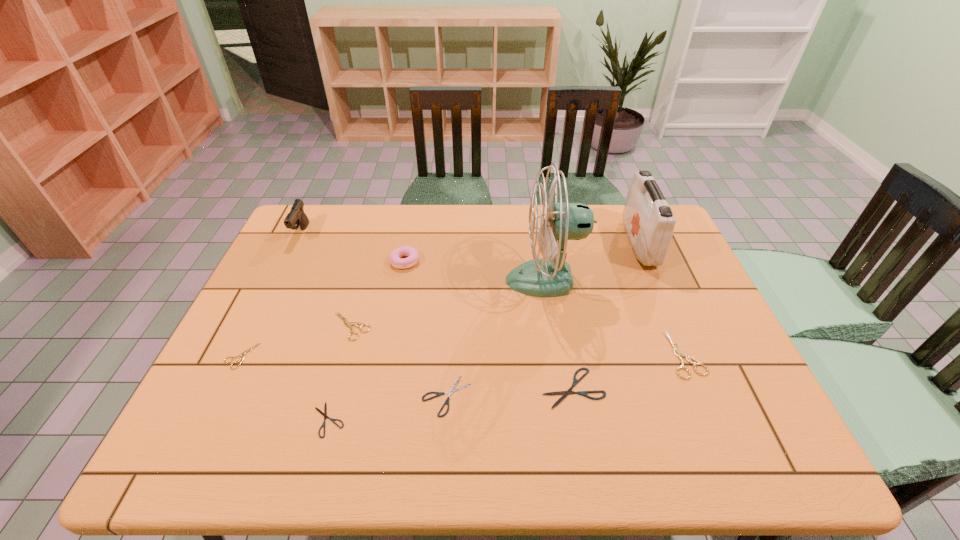
At what (x,y) coordinates should I click in order to perform the action: click on free point that satisfies the following two spatial constraints: 1. on the back side of the shortest shears; 2. on the right side of the fourth shears from left to right. Please return your answer as a coordinate pair (x, y). This screenshot has width=960, height=540. Looking at the image, I should click on (335, 396).

You are a GUI agent. You are given a task and a screenshot of the screen. Output one action in this format:
    pyautogui.click(x=<x>, y=<y>)
    Task: Click on the free space that satisfies the following two spatial constraints: 1. at the barrel of the fifth object from left to right; 2. on the right side of the black pistol
    
    Given the screenshot: What is the action you would take?
    pyautogui.click(x=288, y=261)